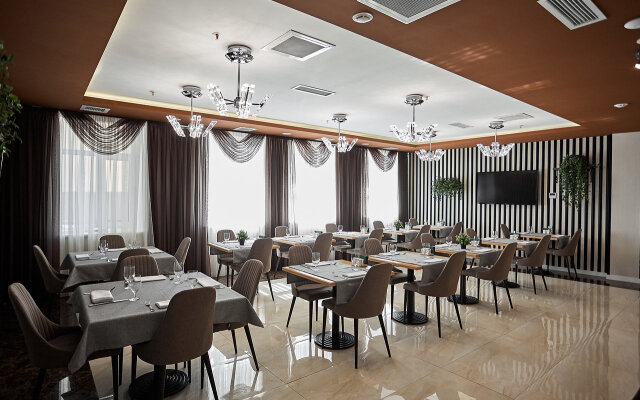
Find the location of a particular element. floor length curtains is located at coordinates (54, 186), (163, 177), (275, 184), (287, 183), (195, 178), (347, 186), (365, 186), (404, 188).